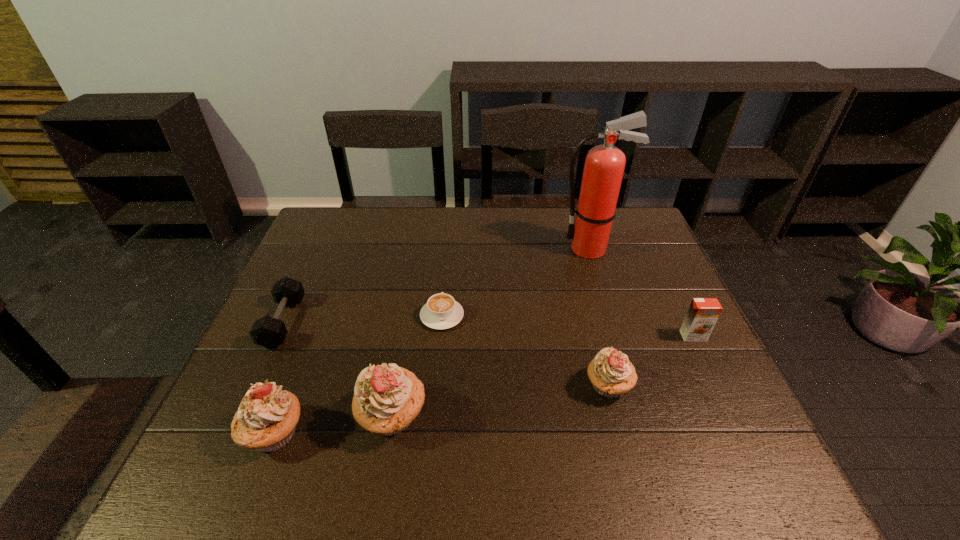
At what (x,y) coordinates should I click in order to perform the action: click on object located at the far edge. Please return your answer as a coordinate pair (x, y). Looking at the image, I should click on (604, 165).

At what (x,y) coordinates should I click in order to perform the action: click on cupcake that is at the left edge. Please return your answer as a coordinate pair (x, y). Image resolution: width=960 pixels, height=540 pixels. Looking at the image, I should click on (266, 419).

Identify the location of dumbbell at the left edge. (270, 332).

Find the location of `fire extinguisher that is positioned at the right edge`. fire extinguisher that is positioned at the right edge is located at coordinates (604, 165).

You are a GUI agent. You are given a task and a screenshot of the screen. Output one action in this format:
    pyautogui.click(x=<x>, y=<y>)
    Task: Click on the orange juice present at the right edge
    The width and height of the screenshot is (960, 540).
    Given the screenshot: What is the action you would take?
    (703, 313)

Identify the location of object at the near left corner. (266, 419).

Locate an element on the screen. object at the far right corner is located at coordinates (604, 165).

Locate an element on the screen. free space at the far edge of the desktop is located at coordinates (473, 216).

Image resolution: width=960 pixels, height=540 pixels. What are the coordinates of `vacant space at the near edge of the desktop` in the screenshot? It's located at (471, 435).

This screenshot has width=960, height=540. In the image, there is a desktop. In order to click on free region at the left edge in this screenshot , I will do `click(316, 291)`.